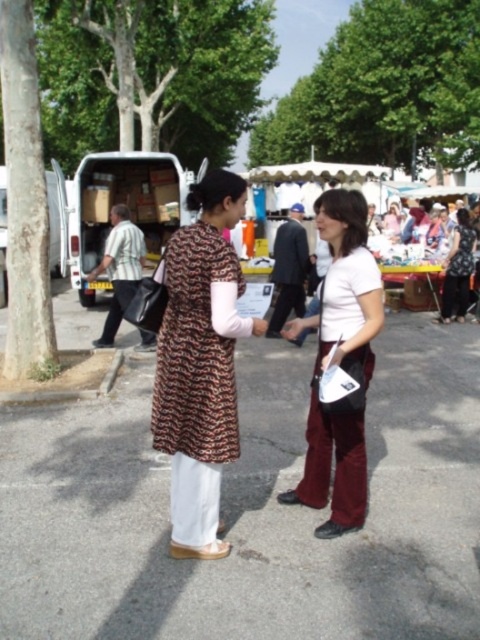
Can you confirm if brown printed dress at center is positioned above striped shirt at left?

Incorrect, brown printed dress at center is not positioned above striped shirt at left.

Between point (218, 496) and point (145, 333), which one is positioned in front?

Point (218, 496) is more forward.

Locate an element on the screen. This screenshot has width=480, height=640. brown printed dress at center is located at coordinates 200,364.

Consider the image. How distant is striped shirt at left from matte black dress at center?

striped shirt at left and matte black dress at center are 5.07 meters apart.

You are a GUI agent. You are given a task and a screenshot of the screen. Output one action in this format:
    pyautogui.click(x=<x>, y=<y>)
    Task: Click on the striped shirt at left
    This screenshot has height=640, width=480.
    Given the screenshot: What is the action you would take?
    pyautogui.click(x=120, y=268)

Identify the location of striped shirt at left. The width and height of the screenshot is (480, 640). (120, 268).

Measure the distance from brown printed dress at center to matte black dress at center.

brown printed dress at center and matte black dress at center are 7.26 meters apart from each other.

Between brown printed dress at center and matte black dress at center, which one is positioned lower?

brown printed dress at center

Is point (171, 301) less distant than point (459, 241)?

Yes.

Where is `brown printed dress at center`? The image size is (480, 640). brown printed dress at center is located at coordinates pyautogui.click(x=200, y=364).